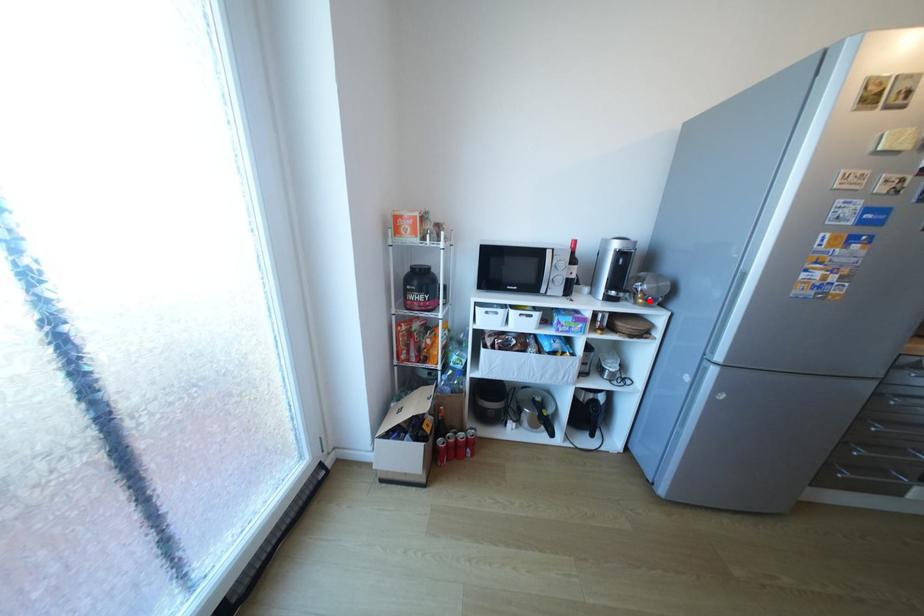
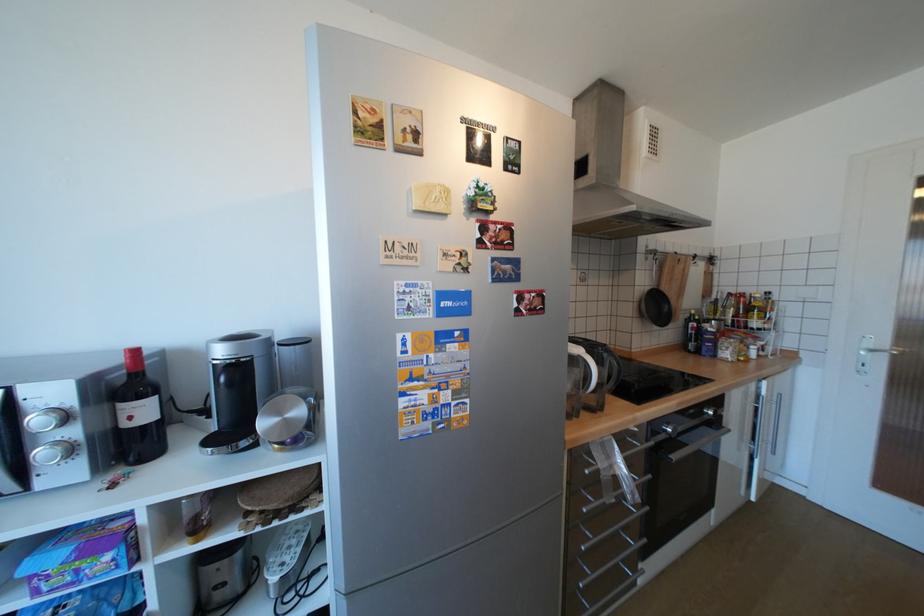
In the second image, find the point that corresponds to the highlighted location in the first image.

(286, 446)